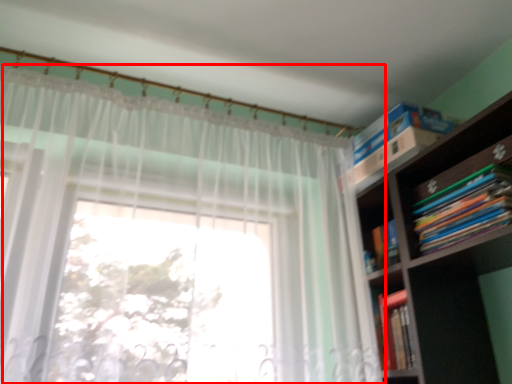
Question: From the image's perspective, what is the correct spatial relationship of curtain (annotated by the red box) in relation to book?

Choices:
 (A) above
 (B) below

Answer: (B)